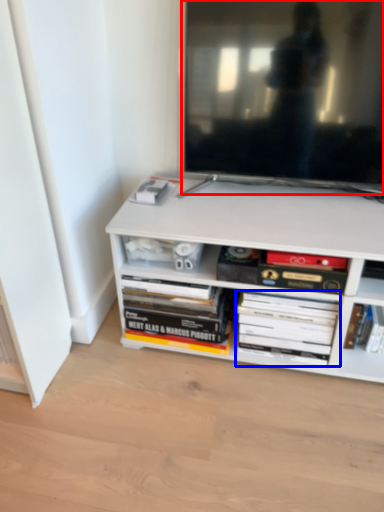
Question: Which point is further to the camera, television (highlighted by a red box) or book (highlighted by a blue box)?

Choices:
 (A) television
 (B) book

Answer: (B)